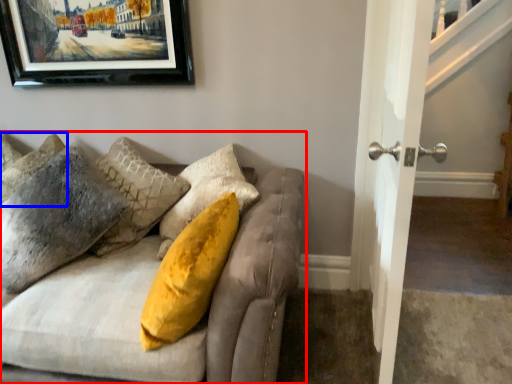
Question: Which object is further to the camera taking this photo, studio couch (highlighted by a red box) or pillow (highlighted by a blue box)?

Choices:
 (A) studio couch
 (B) pillow

Answer: (B)